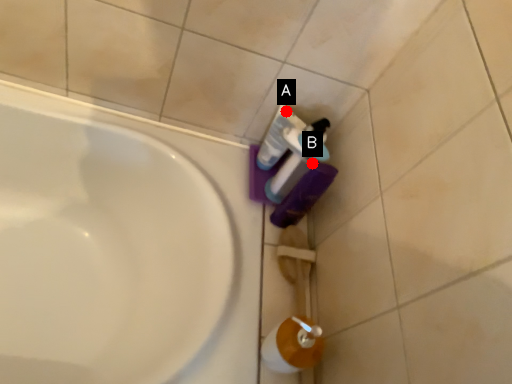
Question: Two points are circled on the image, labeled by A and B beside each circle. Among these points, which one is farthest from the camera?

Choices:
 (A) A is further
 (B) B is further

Answer: (A)